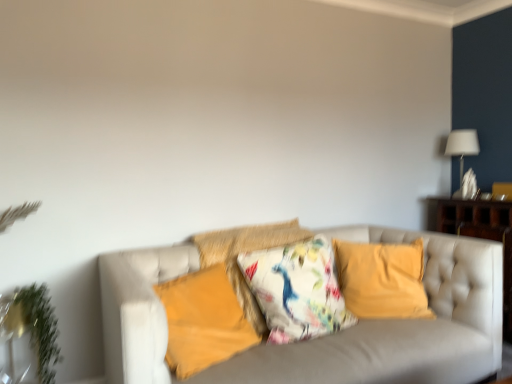
Question: Does wooden dresser at right have a larger size compared to velvet yellow pillow at center, acting as the 1th pillow starting from the right?

Choices:
 (A) no
 (B) yes

Answer: (B)

Question: Is wooden dresser at right to the left of velvet yellow pillow at center, acting as the 1th pillow starting from the right, from the viewer's perspective?

Choices:
 (A) no
 (B) yes

Answer: (A)

Question: Is wooden dresser at right completely or partially outside of velvet yellow pillow at center, acting as the 1th pillow starting from the right?

Choices:
 (A) no
 (B) yes

Answer: (B)

Question: Is wooden dresser at right shorter than velvet yellow pillow at center, acting as the fourth pillow starting from the left?

Choices:
 (A) no
 (B) yes

Answer: (A)

Question: Is wooden dresser at right at the right side of velvet yellow pillow at center, acting as the fourth pillow starting from the left?

Choices:
 (A) yes
 (B) no

Answer: (A)

Question: Is wooden dresser at right far from velvet yellow pillow at center, acting as the fourth pillow starting from the left?

Choices:
 (A) no
 (B) yes

Answer: (A)

Question: From the image's perspective, is velvet yellow pillow at center, acting as the 1th pillow starting from the right, above floral fabric cushion at center, which is the third pillow in right-to-left order?

Choices:
 (A) yes
 (B) no

Answer: (B)

Question: Is velvet yellow pillow at center, acting as the 1th pillow starting from the right, smaller than floral fabric cushion at center, the second pillow viewed from the left?

Choices:
 (A) yes
 (B) no

Answer: (A)

Question: Considering the relative positions of velvet yellow pillow at center, acting as the fourth pillow starting from the left, and floral fabric cushion at center, which is the third pillow in right-to-left order, in the image provided, is velvet yellow pillow at center, acting as the fourth pillow starting from the left, to the right of floral fabric cushion at center, which is the third pillow in right-to-left order, from the viewer's perspective?

Choices:
 (A) yes
 (B) no

Answer: (A)

Question: Would you say velvet yellow pillow at center, acting as the 1th pillow starting from the right, is outside floral fabric cushion at center, the second pillow viewed from the left?

Choices:
 (A) no
 (B) yes

Answer: (B)

Question: Is velvet yellow pillow at center, acting as the fourth pillow starting from the left, aimed at floral fabric cushion at center, the second pillow viewed from the left?

Choices:
 (A) no
 (B) yes

Answer: (A)

Question: From a real-world perspective, is velvet yellow pillow at center, acting as the fourth pillow starting from the left, physically above floral fabric cushion at center, the second pillow viewed from the left?

Choices:
 (A) no
 (B) yes

Answer: (A)

Question: Is green leafy plant at left bigger than white fabric lampshade at upper right?

Choices:
 (A) no
 (B) yes

Answer: (B)